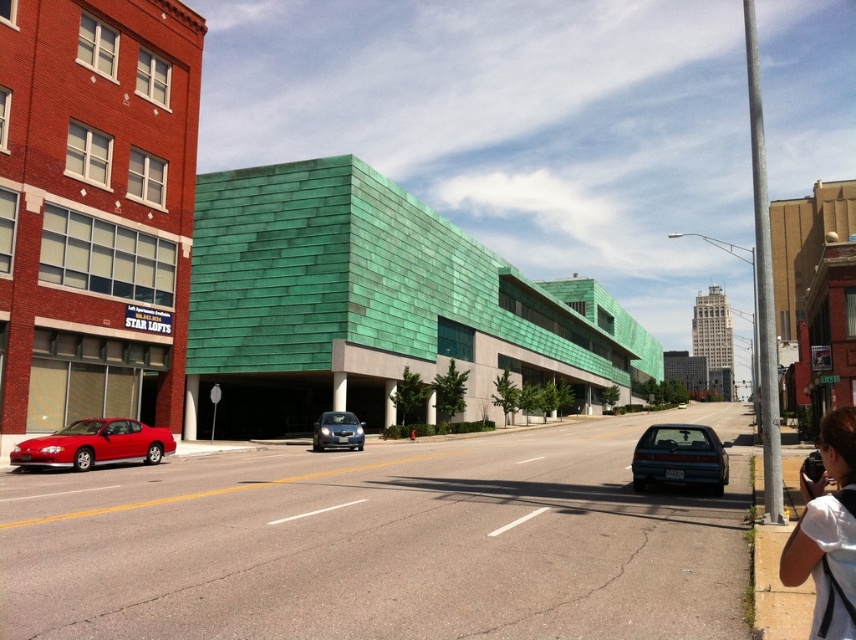
Does teal glossy sedan at lower right come behind satin blue sedan at center?

That is False.

Is point (672, 481) in front of point (325, 412)?

That is True.

Who is more distant from viewer, (704, 456) or (336, 444)?

The point (336, 444) is behind.

The height and width of the screenshot is (640, 856). I want to click on teal glossy sedan at lower right, so click(x=681, y=456).

Between matte red car at lower left and satin blue sedan at center, which one has less height?

With less height is matte red car at lower left.

Does matte red car at lower left have a smaller size compared to satin blue sedan at center?

No.

The width and height of the screenshot is (856, 640). What are the coordinates of `matte red car at lower left` in the screenshot? It's located at (94, 444).

This screenshot has width=856, height=640. What are the coordinates of `matte red car at lower left` in the screenshot? It's located at (94, 444).

How distant is white fabric at lower right from matte red car at lower left?

white fabric at lower right and matte red car at lower left are 20.32 meters apart.

Can you confirm if white fabric at lower right is taller than matte red car at lower left?

In fact, white fabric at lower right may be shorter than matte red car at lower left.

Is point (853, 436) behind point (116, 426)?

No.

Identify the location of white fabric at lower right. (827, 532).